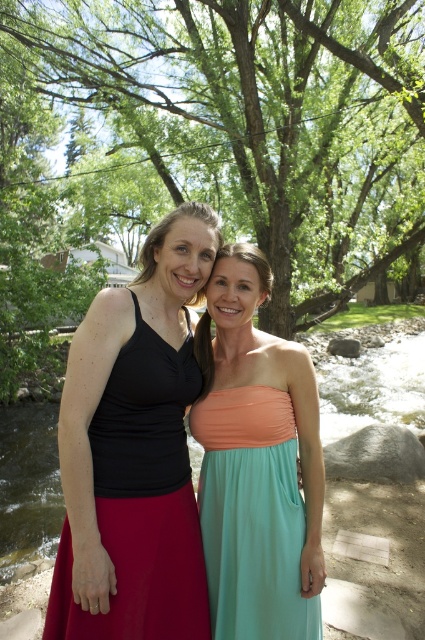
Is teal satin strapless dress at center in front of green fabric dress at center?

Yes, it is in front of green fabric dress at center.

Does point (252, 426) come farther from viewer compared to point (23, 417)?

That is False.

Does point (269, 461) lie in front of point (47, 452)?

Yes.

Find the location of a particular element. This screenshot has height=640, width=425. teal satin strapless dress at center is located at coordinates 252,515.

Who is positioned more to the right, matte black dress at left or teal satin strapless dress at center?

teal satin strapless dress at center is more to the right.

Between matte black dress at left and teal satin strapless dress at center, which one has more height?

matte black dress at left

The image size is (425, 640). What are the coordinates of `matte black dress at left` in the screenshot? It's located at (141, 500).

Who is shorter, matte black dress at left or green fabric dress at center?

matte black dress at left is shorter.

Can you confirm if matte black dress at left is wider than green fabric dress at center?

No.

Looking at this image, measure the distance between point (170, 410) and camera.

Point (170, 410) is 2.06 meters away from camera.

Image resolution: width=425 pixels, height=640 pixels. I want to click on matte black dress at left, so click(x=141, y=500).